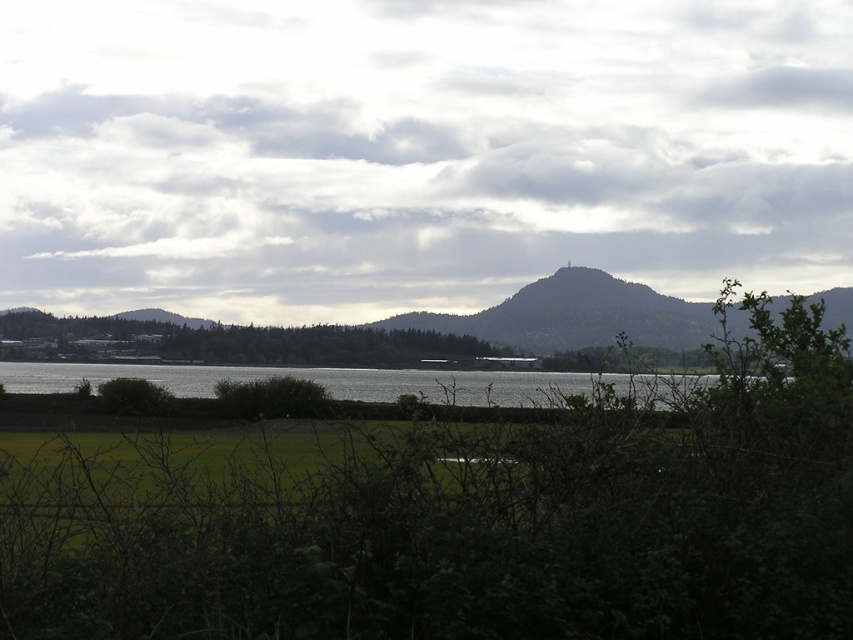
Does cloudy sky at upper center appear over silvery reflective water at center?

Indeed, cloudy sky at upper center is positioned over silvery reflective water at center.

Between point (625, 244) and point (189, 387), which one is positioned in front?

Point (189, 387)

Between point (254, 224) and point (413, 394), which one is positioned behind?

The point (254, 224) is more distant.

Where is `cloudy sky at upper center`? This screenshot has width=853, height=640. cloudy sky at upper center is located at coordinates (416, 150).

Does point (558, 314) come behind point (256, 371)?

Yes, it is.

Can you confirm if green leafy mountain at center is positioned below silvery reflective water at center?

No.

The width and height of the screenshot is (853, 640). What are the coordinates of `green leafy mountain at center` in the screenshot? It's located at (573, 316).

Is cloudy sky at upper center above green leafy mountain at center?

Yes.

Identify the location of cloudy sky at upper center. The image size is (853, 640). (416, 150).

Where is `cloudy sky at upper center`? This screenshot has width=853, height=640. cloudy sky at upper center is located at coordinates (416, 150).